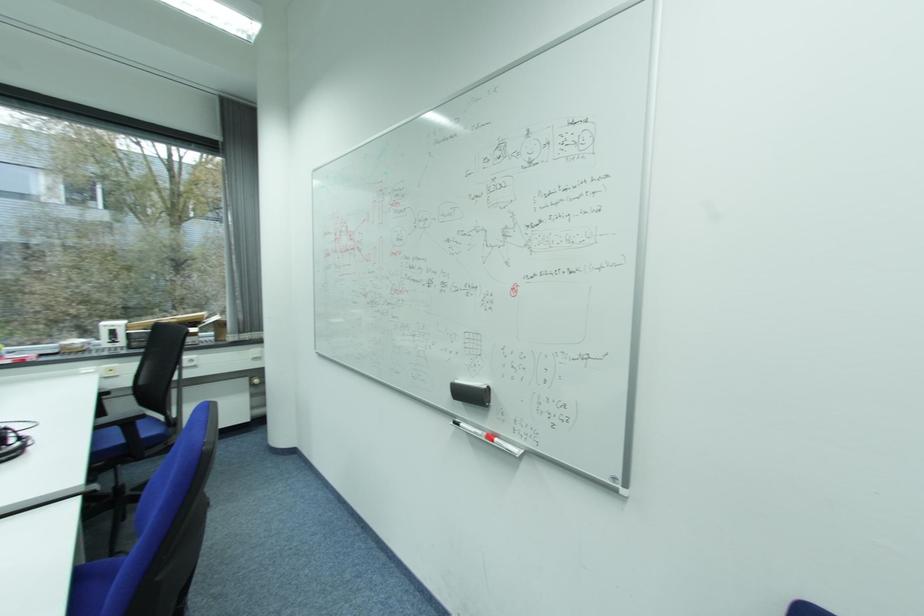
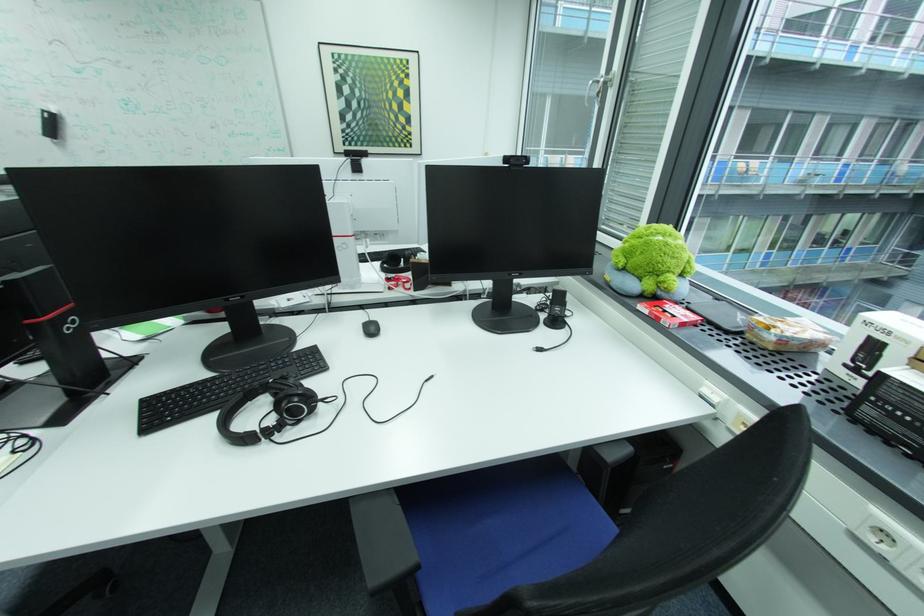
In the second image, find the point that corresponds to (30,365) in the first image.

(662, 322)